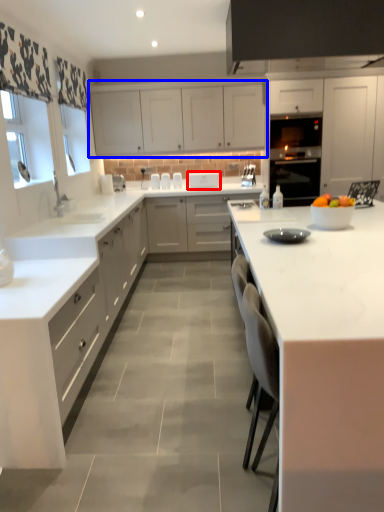
Question: Among these objects, which one is nearest to the camera, appliance (highlighted by a red box) or cabinetry (highlighted by a blue box)?

Choices:
 (A) appliance
 (B) cabinetry

Answer: (B)